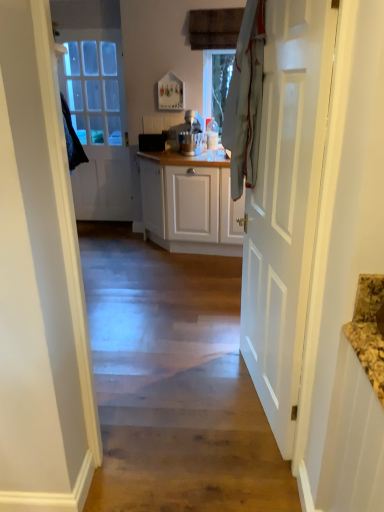
This screenshot has width=384, height=512. I want to click on white matte stand mixer at center, so click(x=191, y=134).

Find the location of a particular element. white glossy door at left, the first door positioned from the back is located at coordinates coord(98,122).

Locate an element on the screen. This screenshot has width=384, height=512. white glossy door at right, which is the 1th door in right-to-left order is located at coordinates (285, 204).

Considering the sizes of white glossy door at left, the 2th door from the right, and wooden floor at center in the image, is white glossy door at left, the 2th door from the right, bigger or smaller than wooden floor at center?

white glossy door at left, the 2th door from the right, is smaller than wooden floor at center.

How many degrees apart are the facing directions of white glossy door at left, the first door in the left-to-right sequence, and wooden floor at center?

The facing directions of white glossy door at left, the first door in the left-to-right sequence, and wooden floor at center are 0.236 degrees apart.

Choose the correct answer: Is white glossy door at left, the 2th door from the right, inside wooden floor at center or outside it?

white glossy door at left, the 2th door from the right, lies outside wooden floor at center.

From the image's perspective, is white glossy door at left, the first door in the left-to-right sequence, above or below wooden floor at center?

Based on their image positions, white glossy door at left, the first door in the left-to-right sequence, is located above wooden floor at center.

Which is in front, point (232, 370) or point (302, 11)?

The point (302, 11) is in front.

Based on the photo, from the image's perspective, which is above, wooden floor at center or white glossy door at right, which appears as the 1th door when viewed from the front?

white glossy door at right, which appears as the 1th door when viewed from the front, from the image's perspective.

From a real-world perspective, which object stands above the other?

In real-world perspective, white glossy door at right, which is the 1th door in right-to-left order, is above.

Is wooden floor at center positioned with its back to white glossy door at right, which appears as the 1th door when viewed from the front?

No, white glossy door at right, which appears as the 1th door when viewed from the front, is not at the back of wooden floor at center.

Based on their sizes in the image, would you say white glossy door at right, the 2th door in the back-to-front sequence, is bigger or smaller than white matte stand mixer at center?

In the image, white glossy door at right, the 2th door in the back-to-front sequence, appears to be larger than white matte stand mixer at center.

From the image's perspective, is white glossy door at right, which is counted as the second door, starting from the left, located beneath white matte stand mixer at center?

Yes, from the image's perspective, white glossy door at right, which is counted as the second door, starting from the left, is below white matte stand mixer at center.

Is white glossy door at right, which appears as the 1th door when viewed from the front, to the left of white matte stand mixer at center from the viewer's perspective?

In fact, white glossy door at right, which appears as the 1th door when viewed from the front, is to the right of white matte stand mixer at center.

Is white glossy door at right, which is the 1th door in right-to-left order, wider or thinner than white matte stand mixer at center?

Considering their sizes, white glossy door at right, which is the 1th door in right-to-left order, looks slimmer than white matte stand mixer at center.

Who is taller, wooden floor at center or white matte stand mixer at center?

white matte stand mixer at center.

Considering the sizes of objects wooden floor at center and white matte stand mixer at center in the image provided, who is bigger, wooden floor at center or white matte stand mixer at center?

Bigger between the two is wooden floor at center.

How different are the orientations of wooden floor at center and white matte stand mixer at center in degrees?

The facing directions of wooden floor at center and white matte stand mixer at center are 8.34 degrees apart.

Is white matte stand mixer at center wider than white glossy door at right, which appears as the 1th door when viewed from the front?

Indeed, white matte stand mixer at center has a greater width compared to white glossy door at right, which appears as the 1th door when viewed from the front.

Is white matte stand mixer at center taller than white glossy door at right, which is the 1th door in right-to-left order?

No.

From the image's perspective, would you say white matte stand mixer at center is shown under white glossy door at right, the 2th door in the back-to-front sequence?

No, from the image's perspective, white matte stand mixer at center is not beneath white glossy door at right, the 2th door in the back-to-front sequence.

Image resolution: width=384 pixels, height=512 pixels. What are the coordinates of `door on the right of white matte stand mixer at center` in the screenshot? It's located at (285, 204).

Considering the positions of objects white glossy door at right, which appears as the 1th door when viewed from the front, and white glossy door at left, the 2th door from the right, in the image provided, who is more to the right, white glossy door at right, which appears as the 1th door when viewed from the front, or white glossy door at left, the 2th door from the right,?

white glossy door at right, which appears as the 1th door when viewed from the front, is more to the right.

This screenshot has height=512, width=384. Find the location of `door lying in front of the white glossy door at left, the first door positioned from the back`. door lying in front of the white glossy door at left, the first door positioned from the back is located at coordinates (285, 204).

Which object is wider, white glossy door at right, which appears as the 1th door when viewed from the front, or white glossy door at left, the first door in the left-to-right sequence?

white glossy door at right, which appears as the 1th door when viewed from the front, is wider.

In the image, is white glossy door at right, the 2th door in the back-to-front sequence, positioned in front of or behind white glossy door at left, the first door in the left-to-right sequence?

white glossy door at right, the 2th door in the back-to-front sequence, is in front of white glossy door at left, the first door in the left-to-right sequence.

Which of these two, white glossy door at left, which is the 2th door from front to back, or white glossy door at right, which appears as the 1th door when viewed from the front, is smaller?

Result: Smaller between the two is white glossy door at left, which is the 2th door from front to back.

Is point (99, 178) behind point (265, 73)?

Yes, it is.

From the image's perspective, which one is positioned higher, white glossy door at left, which is the 2th door from front to back, or white glossy door at right, which appears as the 1th door when viewed from the front?

white glossy door at left, which is the 2th door from front to back, appears higher in the image.

Who is shorter, white glossy door at left, the first door in the left-to-right sequence, or white glossy door at right, which appears as the 1th door when viewed from the front?

Standing shorter between the two is white glossy door at right, which appears as the 1th door when viewed from the front.

From the image's perspective, which door is the 2nd one above the wooden floor at center? Please provide its 2D coordinates.

[(98, 122)]

Where is `path on the left of white glossy door at right, which appears as the 1th door when viewed from the front`? The height and width of the screenshot is (512, 384). path on the left of white glossy door at right, which appears as the 1th door when viewed from the front is located at coordinates (174, 383).

From the image, which object appears to be nearer to white glossy door at left, the first door positioned from the back, white matte stand mixer at center or wooden floor at center?

white matte stand mixer at center is positioned closer to the anchor white glossy door at left, the first door positioned from the back.

From the image, which object appears to be farther from white glossy door at right, the 2th door in the back-to-front sequence, white glossy door at left, the 2th door from the right, or wooden floor at center?

white glossy door at left, the 2th door from the right.

From the image, which object appears to be nearer to white glossy door at right, the 2th door in the back-to-front sequence, white matte stand mixer at center or white glossy door at left, the 2th door from the right?

The object closer to white glossy door at right, the 2th door in the back-to-front sequence, is white matte stand mixer at center.

Considering their positions, is white glossy door at right, which is the 1th door in right-to-left order, positioned closer to white glossy door at left, which is the 2th door from front to back, than white matte stand mixer at center?

Among the two, white matte stand mixer at center is located nearer to white glossy door at left, which is the 2th door from front to back.

Considering their positions, is white matte stand mixer at center positioned further to wooden floor at center than white glossy door at left, the 2th door from the right?

Among the two, white glossy door at left, the 2th door from the right, is located further to wooden floor at center.

From the picture: Based on their spatial positions, is white glossy door at right, which appears as the 1th door when viewed from the front, or white matte stand mixer at center closer to wooden floor at center?

white glossy door at right, which appears as the 1th door when viewed from the front.

Considering their positions, is white glossy door at left, which is the 2th door from front to back, positioned further to wooden floor at center than white glossy door at right, which appears as the 1th door when viewed from the front?

white glossy door at left, which is the 2th door from front to back, lies further to wooden floor at center than the other object.

From the image, which object appears to be nearer to white glossy door at right, which is the 1th door in right-to-left order, white glossy door at left, the first door positioned from the back, or white matte stand mixer at center?

white matte stand mixer at center.

Where is `path between white glossy door at right, which appears as the 1th door when viewed from the front, and white matte stand mixer at center from front to back`? The image size is (384, 512). path between white glossy door at right, which appears as the 1th door when viewed from the front, and white matte stand mixer at center from front to back is located at coordinates (174, 383).

The image size is (384, 512). In order to click on appliance between white glossy door at right, the 2th door in the back-to-front sequence, and white glossy door at left, the 2th door from the right, along the z-axis in this screenshot , I will do `click(191, 134)`.

Image resolution: width=384 pixels, height=512 pixels. Find the location of `appliance located between wooden floor at center and white glossy door at left, which is the 2th door from front to back, in the depth direction`. appliance located between wooden floor at center and white glossy door at left, which is the 2th door from front to back, in the depth direction is located at coordinates (191, 134).

I want to click on path between white glossy door at right, which appears as the 1th door when viewed from the front, and white glossy door at left, the 2th door from the right, along the z-axis, so click(174, 383).